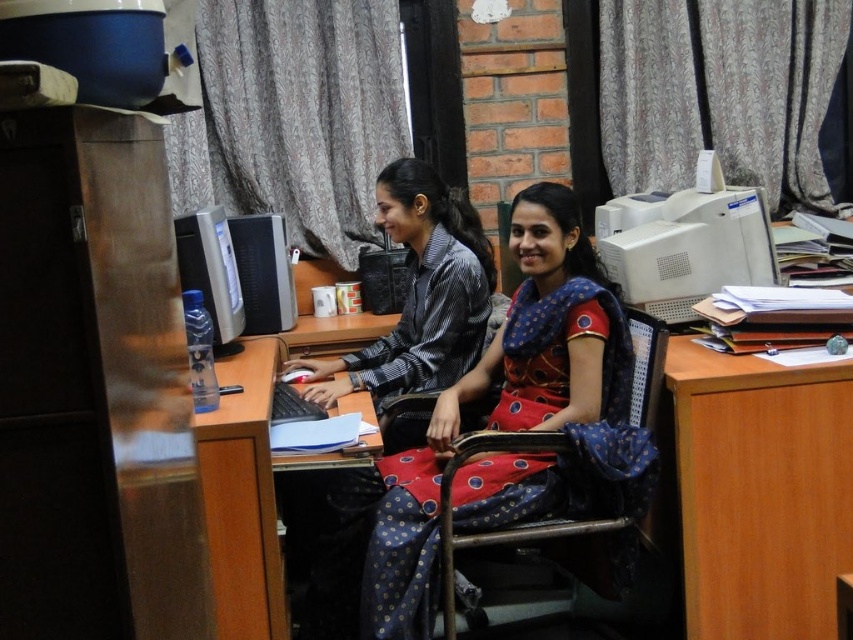
Question: Which point is farther from the camera taking this photo?

Choices:
 (A) (281, 300)
 (B) (780, 408)

Answer: (A)

Question: Is wooden at right positioned in front of metallic blue chair at center?

Choices:
 (A) no
 (B) yes

Answer: (A)

Question: Which object appears farthest from the camera in this image?

Choices:
 (A) white plastic monitor at upper right
 (B) matte black monitor at left
 (C) metallic blue chair at center
 (D) red fabric saree at center

Answer: (A)

Question: Can you confirm if wooden at right is wider than satin black monitor at center?

Choices:
 (A) no
 (B) yes

Answer: (B)

Question: Does red fabric saree at center have a greater width compared to metallic blue chair at center?

Choices:
 (A) no
 (B) yes

Answer: (B)

Question: Which point is farther to the camera?

Choices:
 (A) red fabric saree at center
 (B) white plastic monitor at upper right
 (C) matte black monitor at left

Answer: (B)